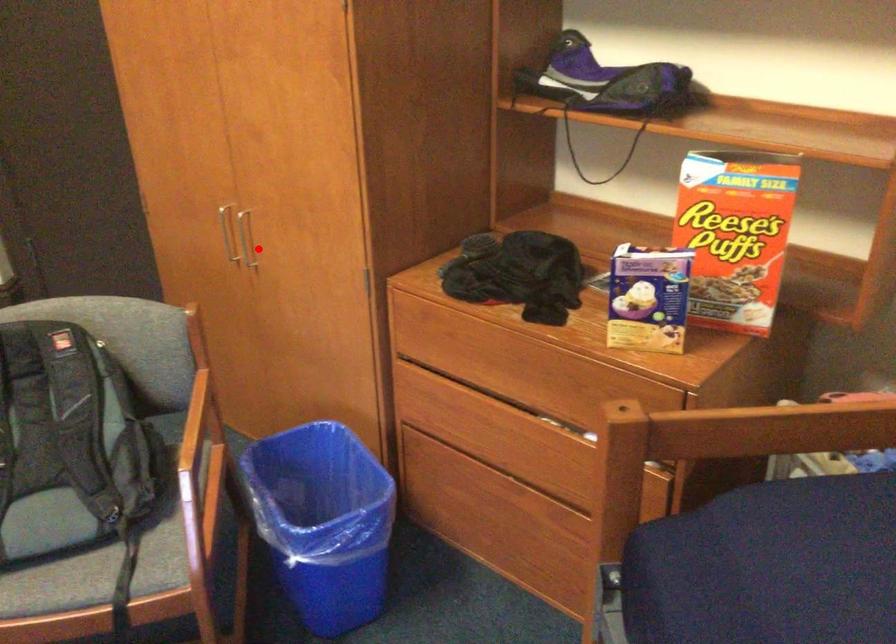
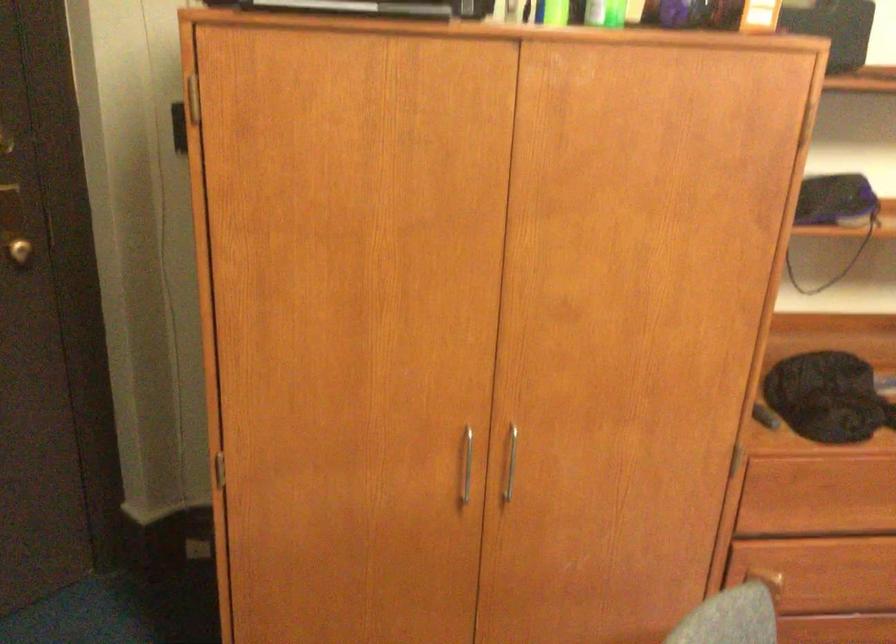
Find the pixel in the second image that matches the highlighted location in the first image.

(511, 462)